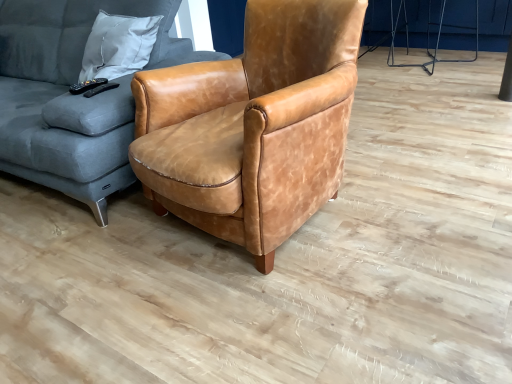
In order to click on vacant area that is in front of matte brown leather armchair at center in this screenshot , I will do `click(281, 310)`.